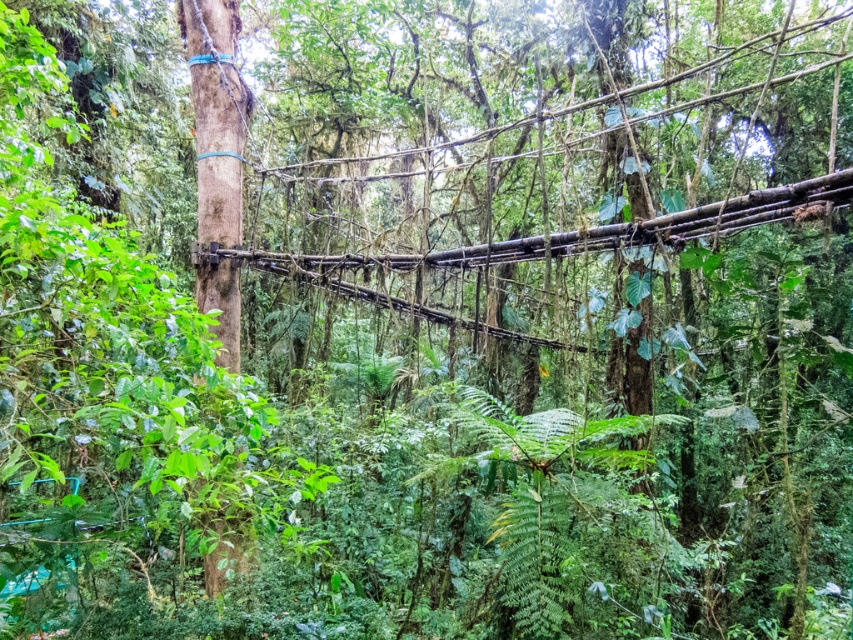
Question: Is brown woven rope bridge at center below smooth brown tree trunk at center?

Choices:
 (A) no
 (B) yes

Answer: (B)

Question: Is brown woven rope bridge at center to the left of smooth brown tree trunk at center from the viewer's perspective?

Choices:
 (A) yes
 (B) no

Answer: (B)

Question: Which of the following is the farthest from the observer?

Choices:
 (A) (x=445, y=266)
 (B) (x=213, y=276)

Answer: (B)

Question: Is brown woven rope bridge at center above smooth brown tree trunk at center?

Choices:
 (A) yes
 (B) no

Answer: (B)